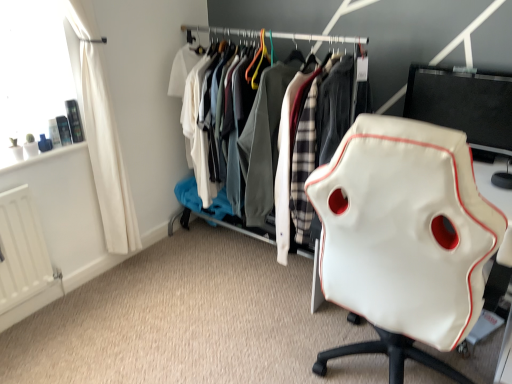
Question: Considering the relative positions of white leather chair at right and white matte radiator at lower left in the image provided, is white leather chair at right to the right of white matte radiator at lower left from the viewer's perspective?

Choices:
 (A) no
 (B) yes

Answer: (B)

Question: Is the surface of white leather chair at right in direct contact with white matte radiator at lower left?

Choices:
 (A) yes
 (B) no

Answer: (B)

Question: Does white leather chair at right appear on the left side of white matte radiator at lower left?

Choices:
 (A) yes
 (B) no

Answer: (B)

Question: Considering the relative sizes of white leather chair at right and white matte radiator at lower left in the image provided, is white leather chair at right shorter than white matte radiator at lower left?

Choices:
 (A) yes
 (B) no

Answer: (B)

Question: Is white leather chair at right wider than white matte radiator at lower left?

Choices:
 (A) yes
 (B) no

Answer: (A)

Question: From a real-world perspective, is white leather chair at right physically below white matte radiator at lower left?

Choices:
 (A) yes
 (B) no

Answer: (B)

Question: Does white matte radiator at lower left have a greater width compared to black glossy monitor at upper right?

Choices:
 (A) yes
 (B) no

Answer: (B)

Question: From a real-world perspective, is white matte radiator at lower left beneath black glossy monitor at upper right?

Choices:
 (A) yes
 (B) no

Answer: (A)

Question: From a real-world perspective, is white matte radiator at lower left on top of black glossy monitor at upper right?

Choices:
 (A) no
 (B) yes

Answer: (A)

Question: Is white matte radiator at lower left bigger than black glossy monitor at upper right?

Choices:
 (A) no
 (B) yes

Answer: (A)

Question: Does white matte radiator at lower left come in front of black glossy monitor at upper right?

Choices:
 (A) no
 (B) yes

Answer: (A)

Question: Is white matte radiator at lower left far away from black glossy monitor at upper right?

Choices:
 (A) no
 (B) yes

Answer: (B)

Question: Is white leather chair at right bigger than white leather jacket at center?

Choices:
 (A) no
 (B) yes

Answer: (A)